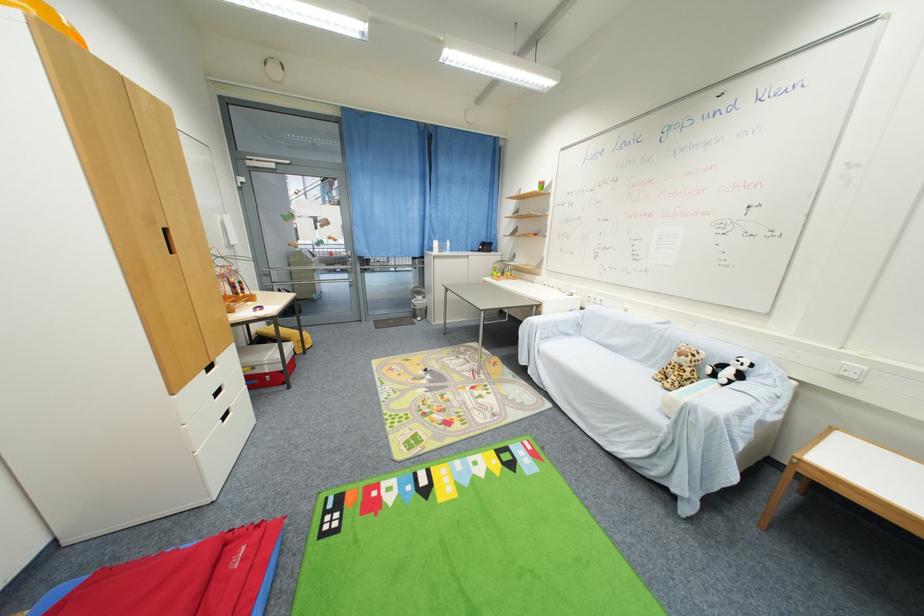
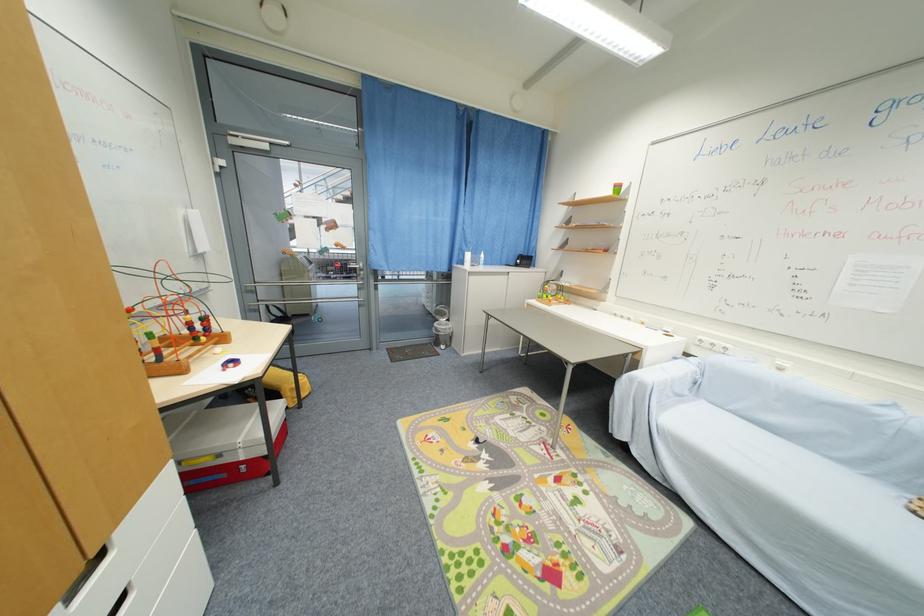
What movement of the cameraman would produce the second image?

The movement direction of the cameraman is left, forward.